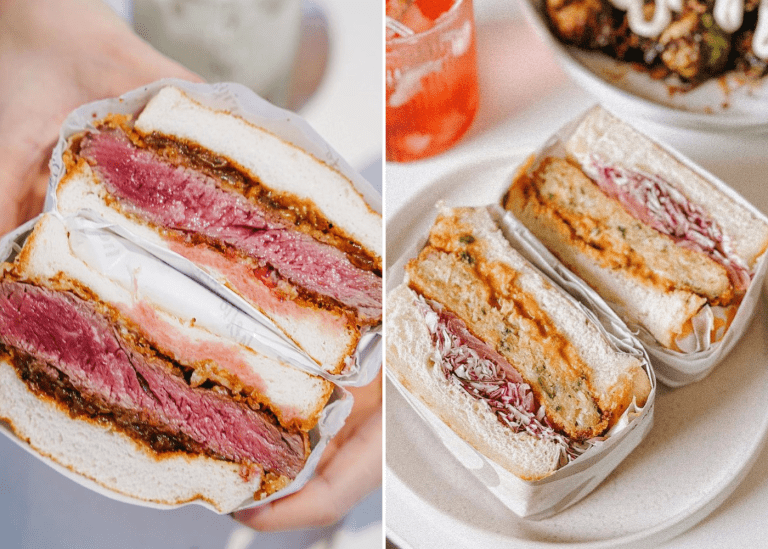
Where is `tabletop`? tabletop is located at coordinates (409, 173).